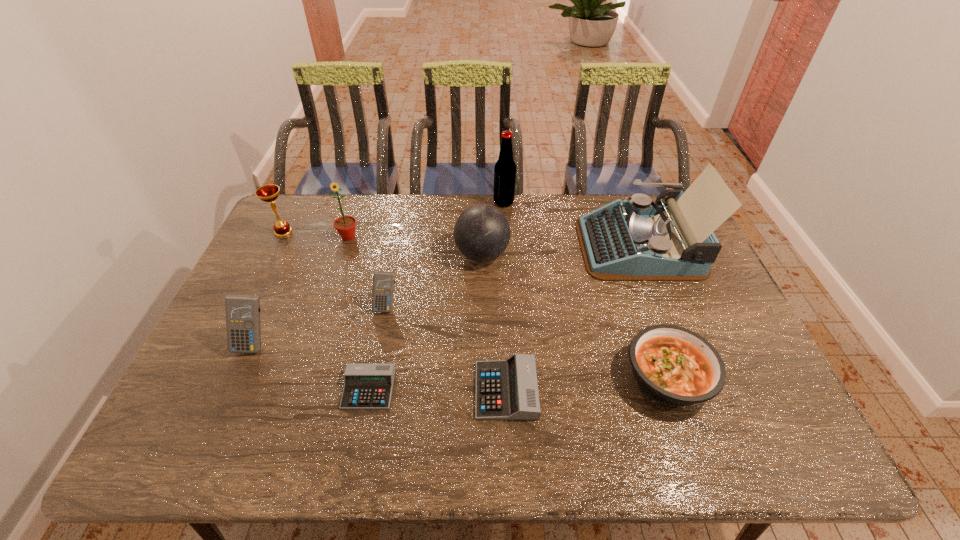
Identify the location of vacant space at the near edge. (410, 460).

In the image, there is a desktop. Identify the location of vacant space at the left edge. The image size is (960, 540). (224, 383).

In the image, there is a desktop. In order to click on blank space at the right edge in this screenshot , I will do `click(688, 327)`.

Where is `vacant region between the green sunflower and the beer bottle`? vacant region between the green sunflower and the beer bottle is located at coordinates (426, 220).

You are a GUI agent. You are given a task and a screenshot of the screen. Output one action in this format:
    pyautogui.click(x=<x>, y=<y>)
    Task: Click on the empty location between the chalice and the eighth tallest object
    The height and width of the screenshot is (540, 960).
    Given the screenshot: What is the action you would take?
    pyautogui.click(x=475, y=305)

Find the location of a particular element. This screenshot has width=960, height=540. unoccupied position between the beer bottle and the bigger gray calculator is located at coordinates (505, 296).

Locate an element on the screen. The height and width of the screenshot is (540, 960). free space between the farther blue calculator and the ninth tallest object is located at coordinates (446, 348).

This screenshot has height=540, width=960. What are the coordinates of `vacant space that's between the green sunflower and the bigger gray calculator` in the screenshot? It's located at (427, 314).

Where is `free space between the chalice and the left gray calculator`? free space between the chalice and the left gray calculator is located at coordinates (326, 310).

Where is `vacant space that's between the fifth nearest object and the stew`? The height and width of the screenshot is (540, 960). vacant space that's between the fifth nearest object and the stew is located at coordinates (527, 342).